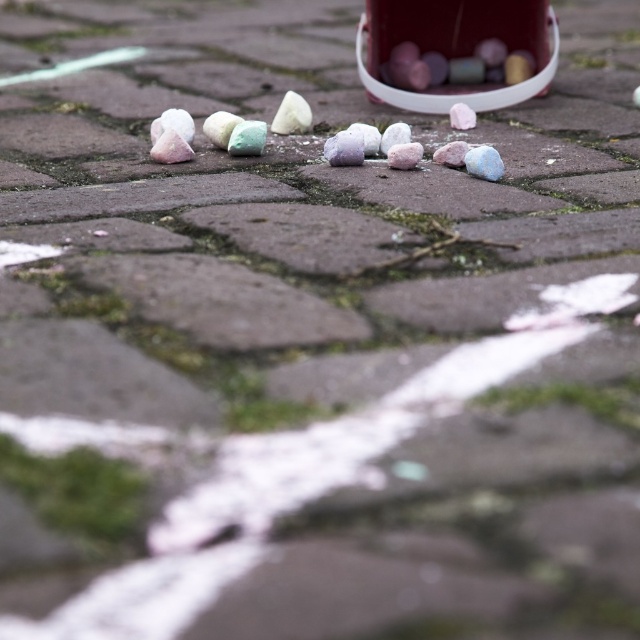
Question: Where is white matte rock at center located in relation to white matte cotton candy at center in the image?

Choices:
 (A) below
 (B) above

Answer: (A)

Question: Among these objects, which one is nearest to the camera?

Choices:
 (A) white matte rock at center
 (B) white matte cotton candy at center
 (C) glossy plastic cotton candy at upper right

Answer: (A)

Question: Which point is farther to the camera?

Choices:
 (A) (451, 108)
 (B) (476, 76)
 (C) (296, 100)

Answer: (B)

Question: Does glossy plastic cotton candy at upper right appear on the left side of white matte rock at center?

Choices:
 (A) no
 (B) yes

Answer: (A)

Question: Is white matte rock at center wider than white matte cotton candy at center?

Choices:
 (A) no
 (B) yes

Answer: (B)

Question: Which point is closer to the camera taking this photo?

Choices:
 (A) (476, 116)
 (B) (289, 99)
 (C) (508, 81)

Answer: (B)